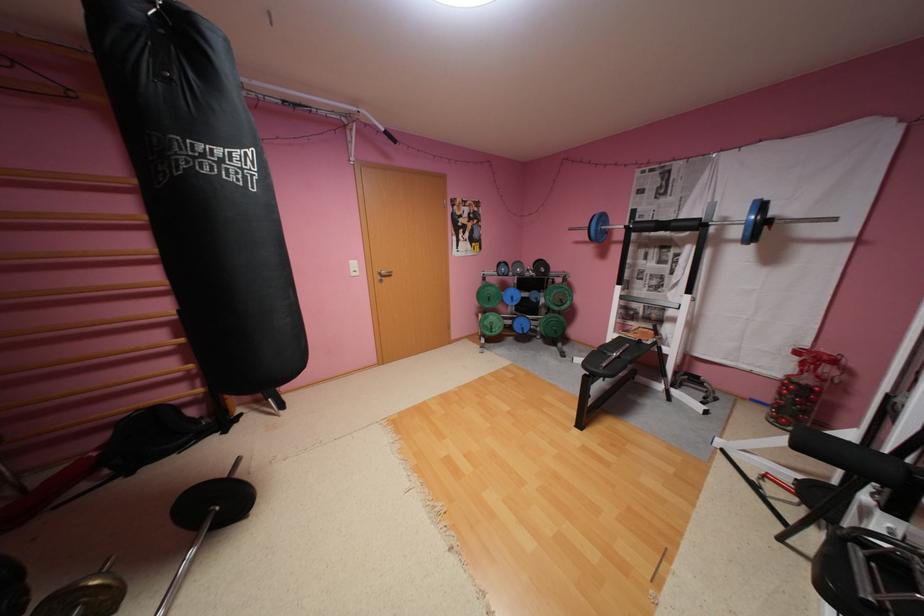
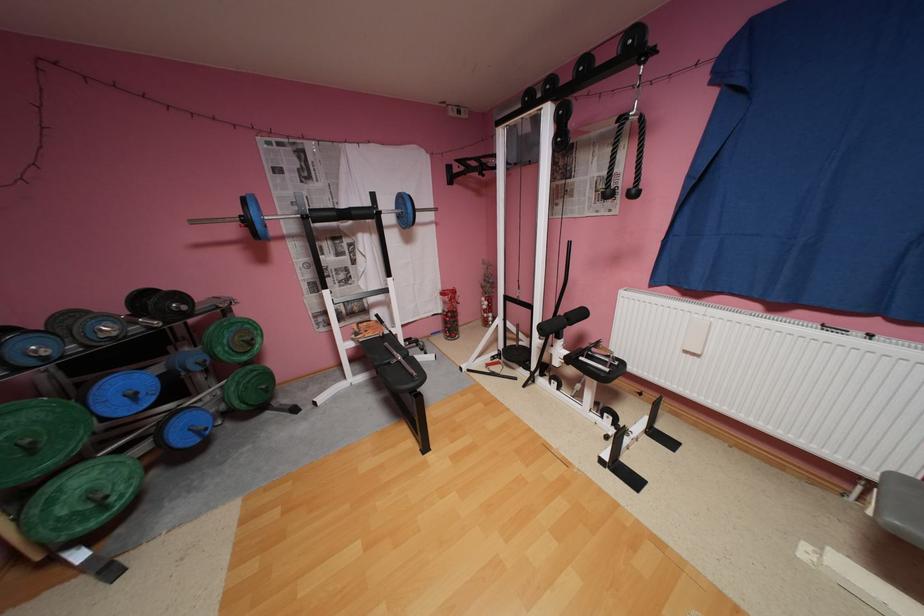
Find the pixel in the second image that matches point 521,298 in the first image.

(142, 395)